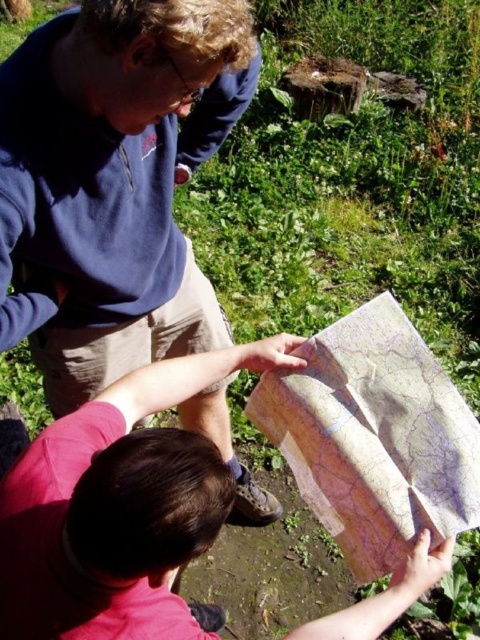
The image size is (480, 640). In order to click on blue fleece at upper left in this screenshot , I will do `click(112, 182)`.

Does blue fleece at upper left appear on the right side of beige paper map at center?

No, blue fleece at upper left is not to the right of beige paper map at center.

Find the location of a particular element. The image size is (480, 640). blue fleece at upper left is located at coordinates (112, 182).

Based on the photo, can you confirm if blue fleece at upper left is positioned below smooth paper map at center?

No.

Who is taller, blue fleece at upper left or smooth paper map at center?

With more height is blue fleece at upper left.

Who is more distant from viewer, (217, 396) or (78, 472)?

The point (217, 396) is behind.

Locate an element on the screen. The height and width of the screenshot is (640, 480). blue fleece at upper left is located at coordinates (112, 182).

Who is positioned more to the left, smooth paper map at center or beige paper map at center?

From the viewer's perspective, smooth paper map at center appears more on the left side.

Is smooth paper map at center shorter than beige paper map at center?

Correct, smooth paper map at center is not as tall as beige paper map at center.

Between point (12, 513) and point (324, 465), which one is positioned behind?

Point (324, 465)

Locate an element on the screen. The image size is (480, 640). smooth paper map at center is located at coordinates (143, 468).